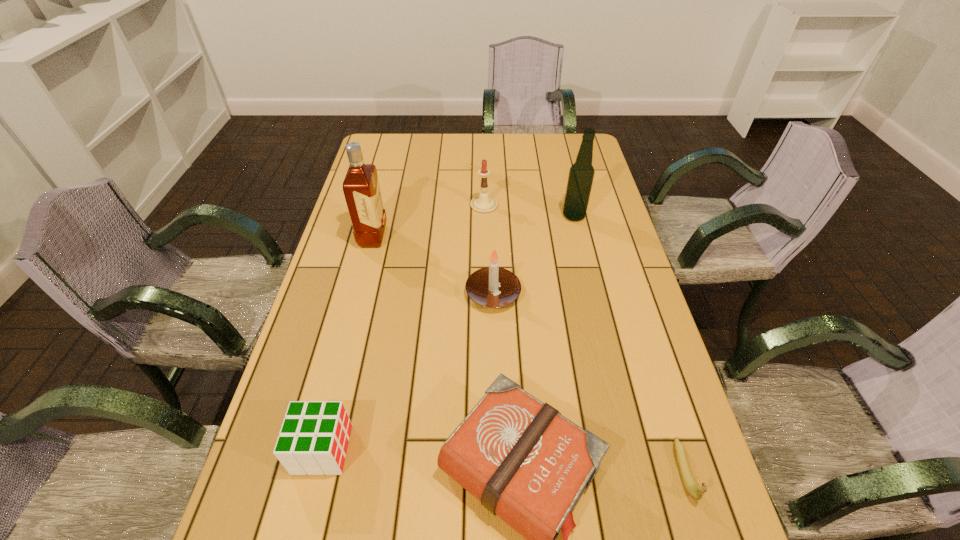
You are a GUI agent. You are given a task and a screenshot of the screen. Output one action in this format:
    pyautogui.click(x=<x>, y=<y>)
    Task: Click on the blank area located on the back of the fourth farthest object
    The image size is (960, 540).
    Given the screenshot: What is the action you would take?
    pyautogui.click(x=491, y=203)

Locate an element on the screen. The width and height of the screenshot is (960, 540). vacant area situated on the red face of the cube is located at coordinates (516, 449).

Locate an element on the screen. The image size is (960, 540). blank area located at the stem of the banana is located at coordinates (703, 534).

Locate an element on the screen. This screenshot has width=960, height=540. liquor at the left edge is located at coordinates (361, 188).

The width and height of the screenshot is (960, 540). What are the coordinates of `cube that is at the left edge` in the screenshot? It's located at (314, 436).

You are a GUI agent. You are given a task and a screenshot of the screen. Output one action in this format:
    pyautogui.click(x=<x>, y=<y>)
    Task: Click on the alcohol situated at the right edge
    This screenshot has width=960, height=540.
    Given the screenshot: What is the action you would take?
    pyautogui.click(x=581, y=174)

Find the location of a particular element. The width and height of the screenshot is (960, 540). banana that is at the right edge is located at coordinates (687, 478).

In the image, there is a desktop. Identify the location of vacant area at the far edge. (507, 139).

At what (x,y) coordinates should I click in order to perform the action: click on vacant space at the left edge of the desktop. Please return your answer as a coordinate pair (x, y). Looking at the image, I should click on (394, 217).

Identify the location of free space at the right edge of the desktop. (604, 261).